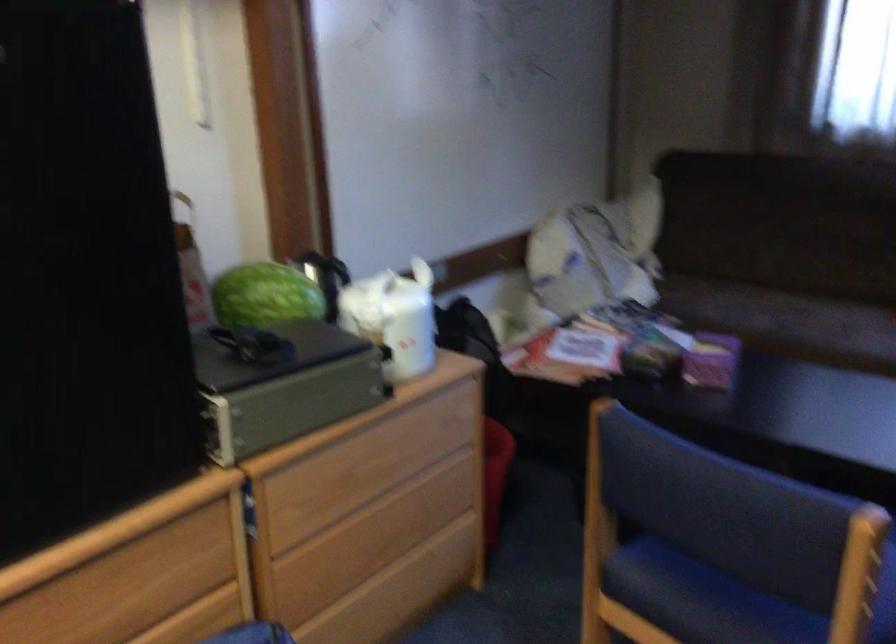
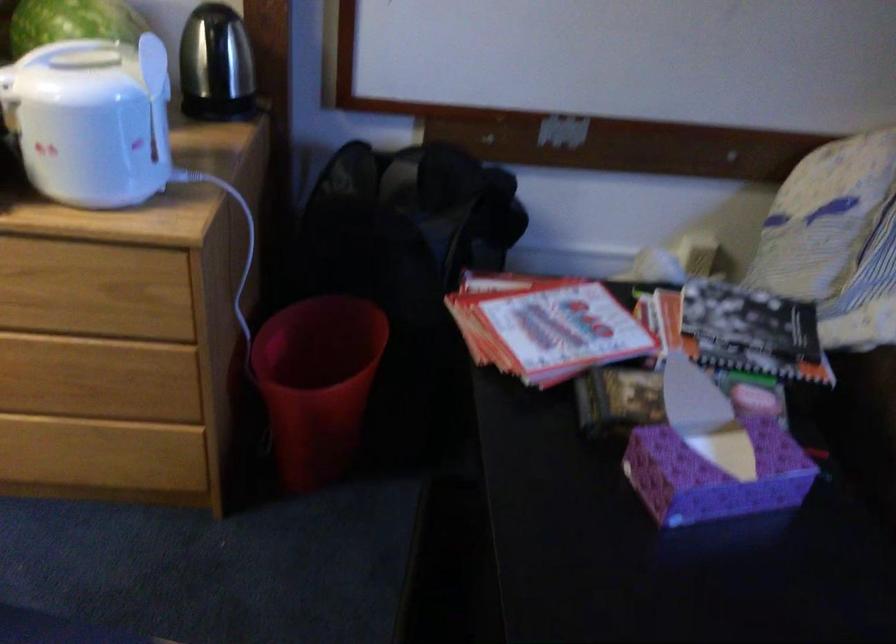
In the second image, find the point that corresponds to [721,352] in the first image.

(714, 475)